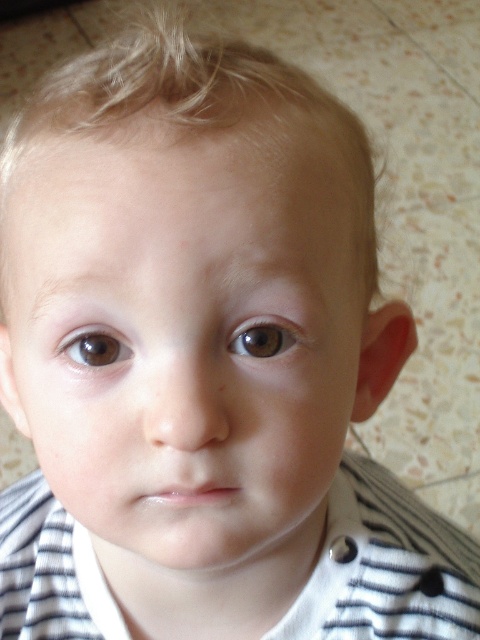
Where is `smooth skin face at center`? This screenshot has width=480, height=640. smooth skin face at center is located at coordinates (182, 340).

Does smooth skin face at center have a larger size compared to brown matte eye at center?

Yes.

Between point (225, 470) and point (277, 340), which one is positioned in front?

Point (225, 470)

Where is `smooth skin face at center`? smooth skin face at center is located at coordinates (182, 340).

Does blonde fine hair at upper center have a larger size compared to brown matte eye at center?

Yes.

Based on the photo, is blonde fine hair at upper center wider than brown matte eye at center?

Yes, blonde fine hair at upper center is wider than brown matte eye at center.

Describe the element at coordinates (194, 100) in the screenshot. I see `blonde fine hair at upper center` at that location.

Identify the location of blonde fine hair at upper center. The image size is (480, 640). (194, 100).

Can you confirm if blonde fine hair at upper center is wider than brown matte eye at left?

Yes, blonde fine hair at upper center is wider than brown matte eye at left.

Is point (135, 93) closer to camera compared to point (79, 358)?

Yes, point (135, 93) is in front of point (79, 358).

Does point (14, 145) come closer to viewer compared to point (97, 362)?

That is False.

At what (x,y) coordinates should I click in order to perform the action: click on blonde fine hair at upper center. Please return your answer as a coordinate pair (x, y). The image size is (480, 640). Looking at the image, I should click on (194, 100).